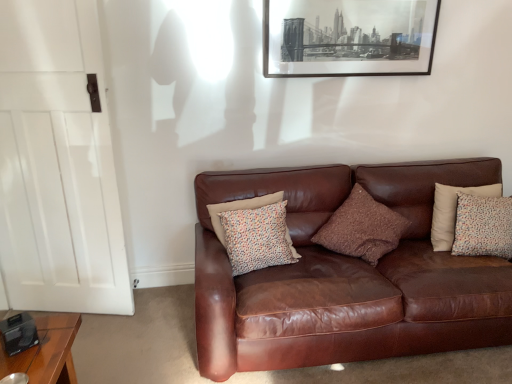
Question: Does white wood door at left have a lesser width compared to brown leather couch at center?

Choices:
 (A) no
 (B) yes

Answer: (B)

Question: Does white wood door at left have a greater height compared to brown leather couch at center?

Choices:
 (A) no
 (B) yes

Answer: (B)

Question: Is white wood door at left positioned far away from brown leather couch at center?

Choices:
 (A) yes
 (B) no

Answer: (A)

Question: Considering the relative positions of white wood door at left and brown leather couch at center in the image provided, is white wood door at left to the right of brown leather couch at center from the viewer's perspective?

Choices:
 (A) no
 (B) yes

Answer: (A)

Question: Is white wood door at left not within brown leather couch at center?

Choices:
 (A) no
 (B) yes

Answer: (B)

Question: Is white wood door at left positioned with its back to brown leather couch at center?

Choices:
 (A) no
 (B) yes

Answer: (A)

Question: Is brown leather couch at center turned away from multicolored fabric pillow at center, positioned as the 3th pillow in right-to-left order?

Choices:
 (A) yes
 (B) no

Answer: (A)

Question: From a real-world perspective, is brown leather couch at center physically below multicolored fabric pillow at center, positioned as the 3th pillow in right-to-left order?

Choices:
 (A) yes
 (B) no

Answer: (A)

Question: Considering the relative sizes of brown leather couch at center and multicolored fabric pillow at center, positioned as the 3th pillow in right-to-left order, in the image provided, is brown leather couch at center shorter than multicolored fabric pillow at center, positioned as the 3th pillow in right-to-left order,?

Choices:
 (A) no
 (B) yes

Answer: (A)

Question: Considering the relative sizes of brown leather couch at center and multicolored fabric pillow at center, positioned as the 3th pillow in right-to-left order, in the image provided, is brown leather couch at center taller than multicolored fabric pillow at center, positioned as the 3th pillow in right-to-left order,?

Choices:
 (A) no
 (B) yes

Answer: (B)

Question: Could you tell me if brown leather couch at center is turned towards multicolored fabric pillow at center, positioned as the 3th pillow in right-to-left order?

Choices:
 (A) no
 (B) yes

Answer: (B)

Question: Can we say brown leather couch at center lies outside multicolored fabric pillow at center, positioned as the 3th pillow in right-to-left order?

Choices:
 (A) yes
 (B) no

Answer: (A)

Question: Is black matte picture frame at upper center not close to brown textured pillow at center, acting as the second pillow starting from the left?

Choices:
 (A) yes
 (B) no

Answer: (B)